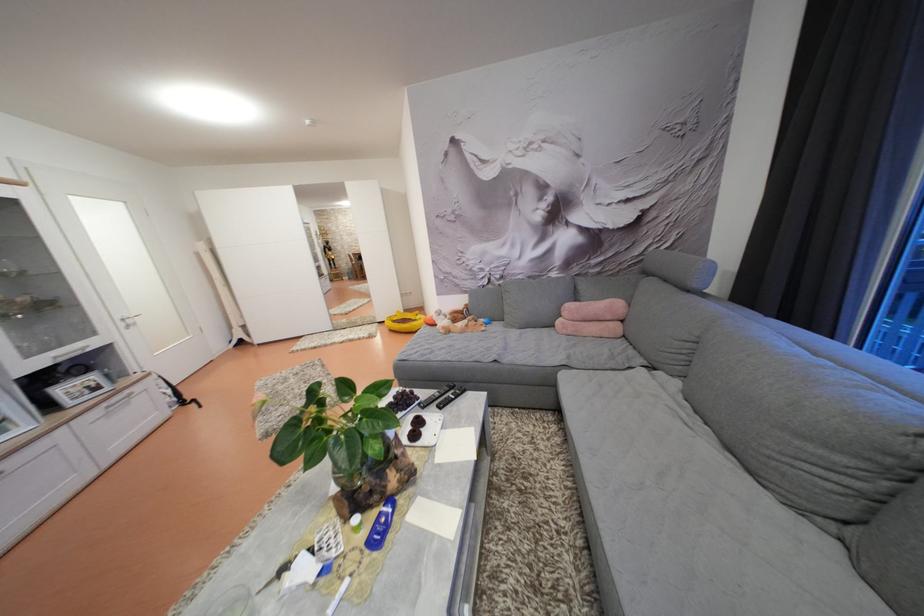
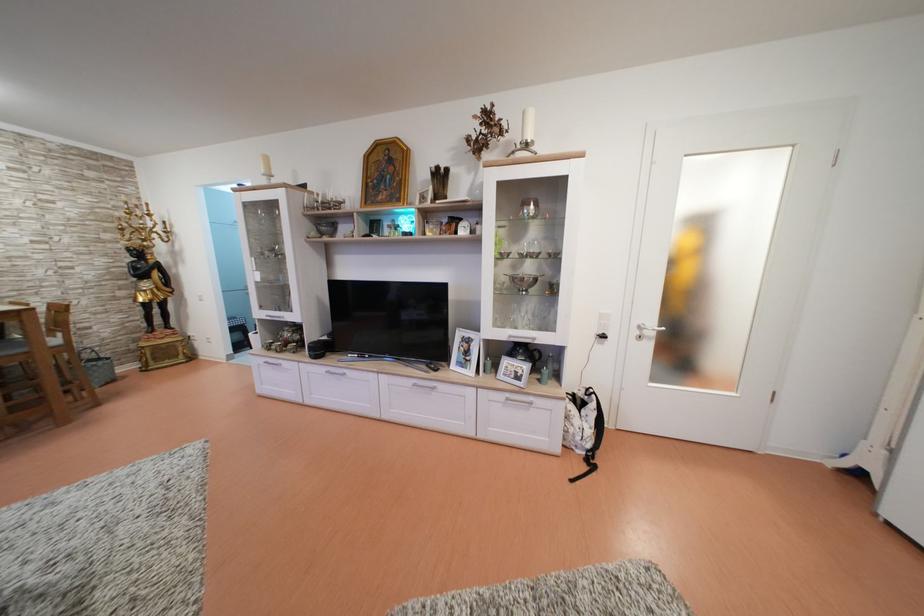
Locate, in the second image, the point that corresponds to [112,410] in the first image.

(515, 400)